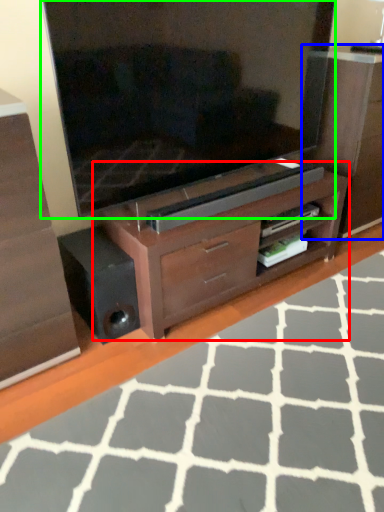
Question: Which is farther away from tv cabinet (highlighted by a red box)? dresser (highlighted by a blue box) or television (highlighted by a green box)?

Choices:
 (A) dresser
 (B) television

Answer: (A)